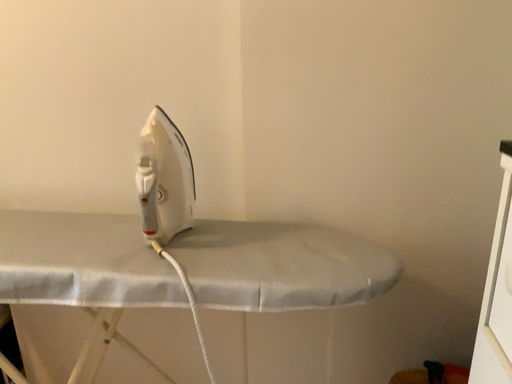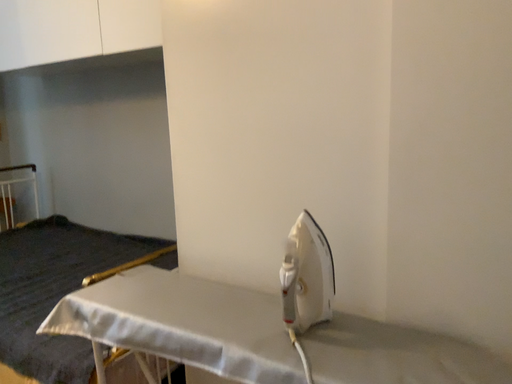
Question: Which way did the camera rotate in the video?

Choices:
 (A) rotated left
 (B) rotated right

Answer: (A)